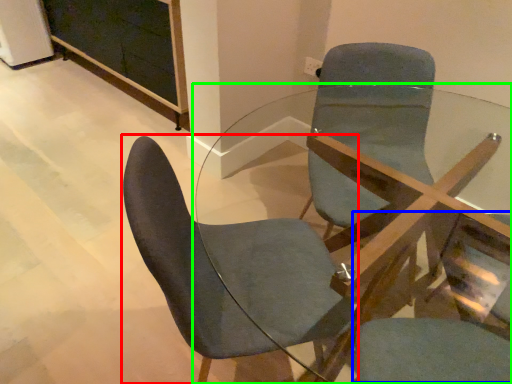
Question: Estimate the real-world distances between objects in this image. Which object is closer to chair (highlighted by a red box), swivel chair (highlighted by a blue box) or table (highlighted by a green box)?

Choices:
 (A) swivel chair
 (B) table

Answer: (B)